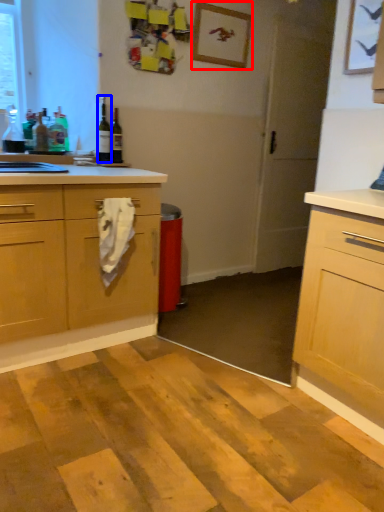
Question: Which of the following is the closest to the observer, picture frame (highlighted by a red box) or bottle (highlighted by a blue box)?

Choices:
 (A) picture frame
 (B) bottle

Answer: (B)